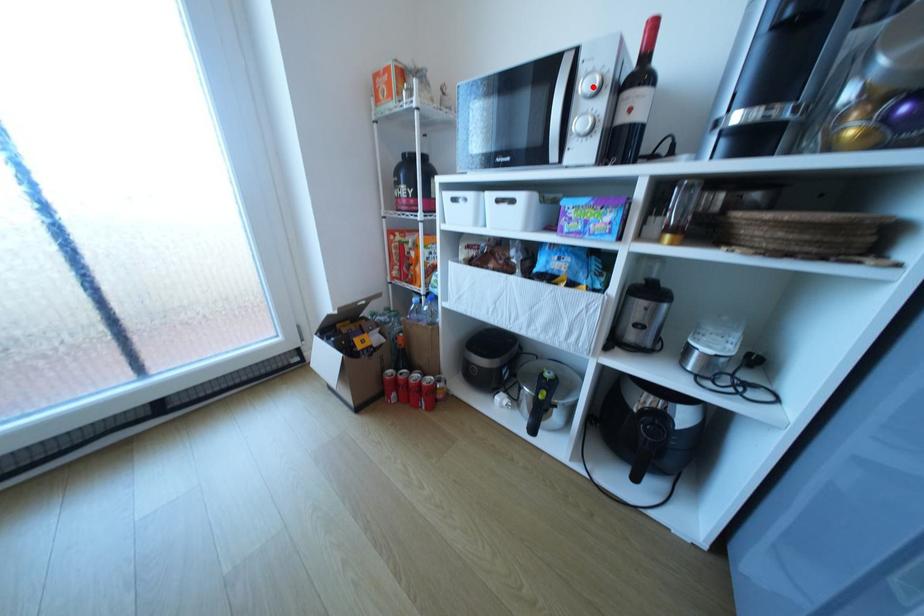
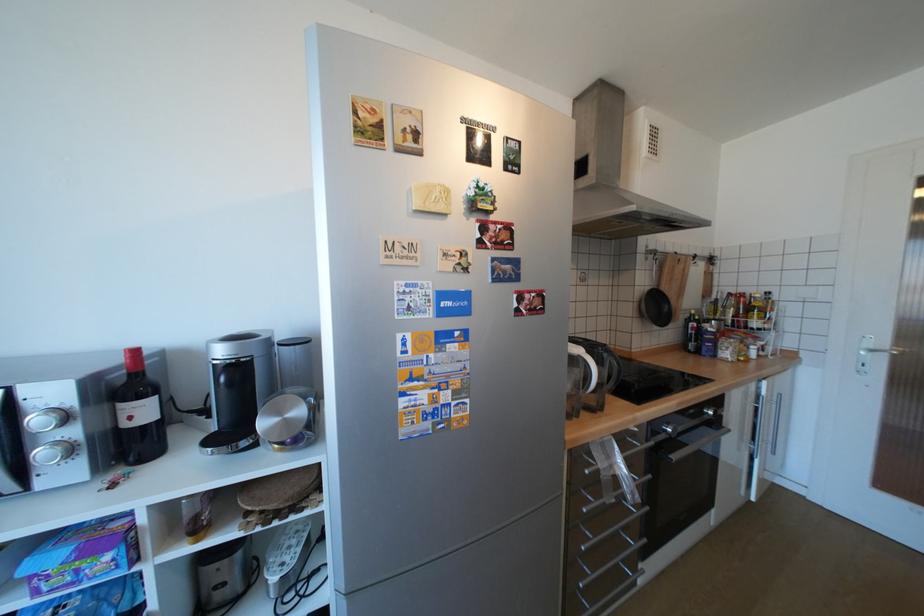
Where in the second image is the point corresponding to the highlighted location from the first image?

(46, 419)